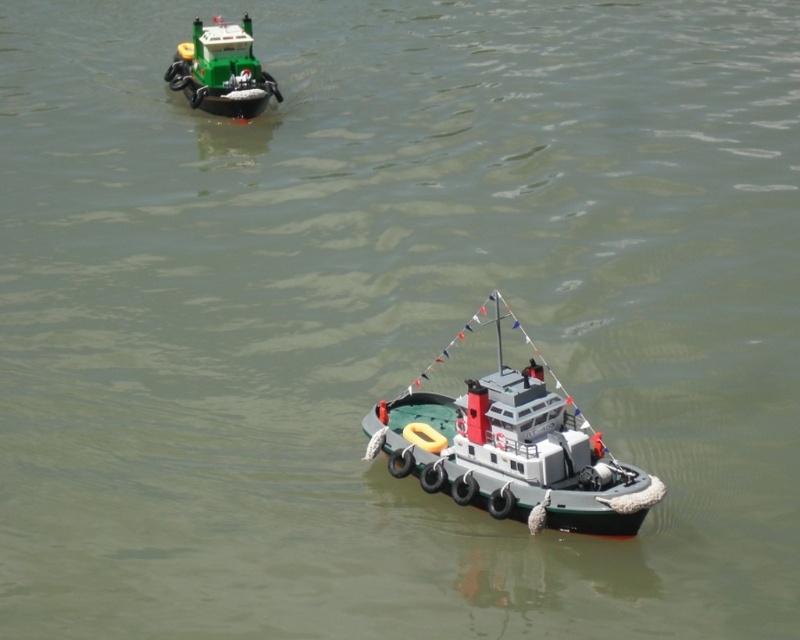
Who is more distant from viewer, (570, 433) or (252, 81)?

The point (252, 81) is more distant.

Can you confirm if gray rubber boat at center is taller than green plastic tugboat at upper left?

Indeed, gray rubber boat at center has a greater height compared to green plastic tugboat at upper left.

Locate an element on the screen. Image resolution: width=800 pixels, height=640 pixels. gray rubber boat at center is located at coordinates (512, 449).